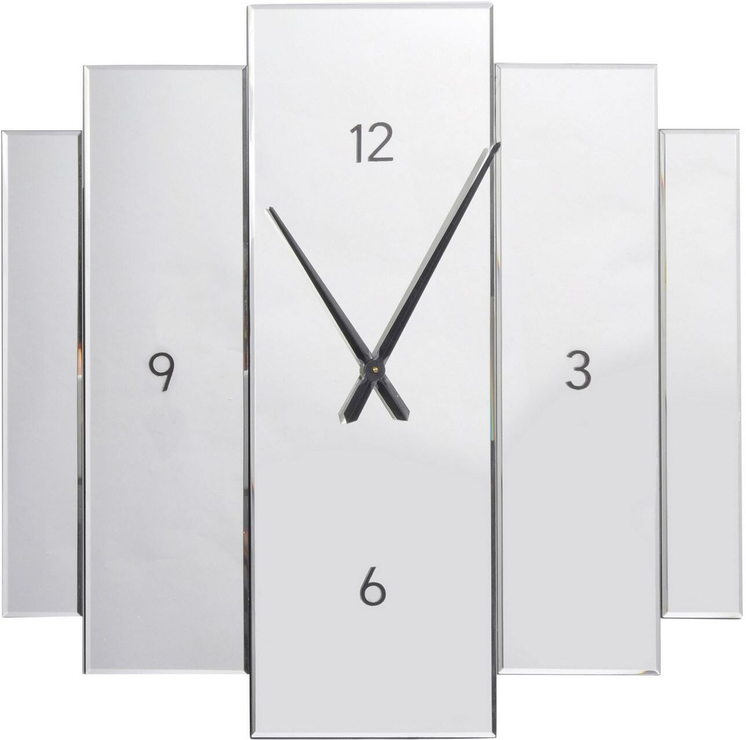
Where is `corner`? Image resolution: width=746 pixels, height=740 pixels. corner is located at coordinates (698, 21).